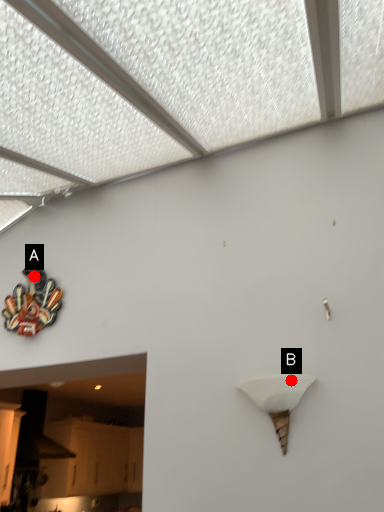
Question: Two points are circled on the image, labeled by A and B beside each circle. Which point is closer to the camera taking this photo?

Choices:
 (A) A is closer
 (B) B is closer

Answer: (B)